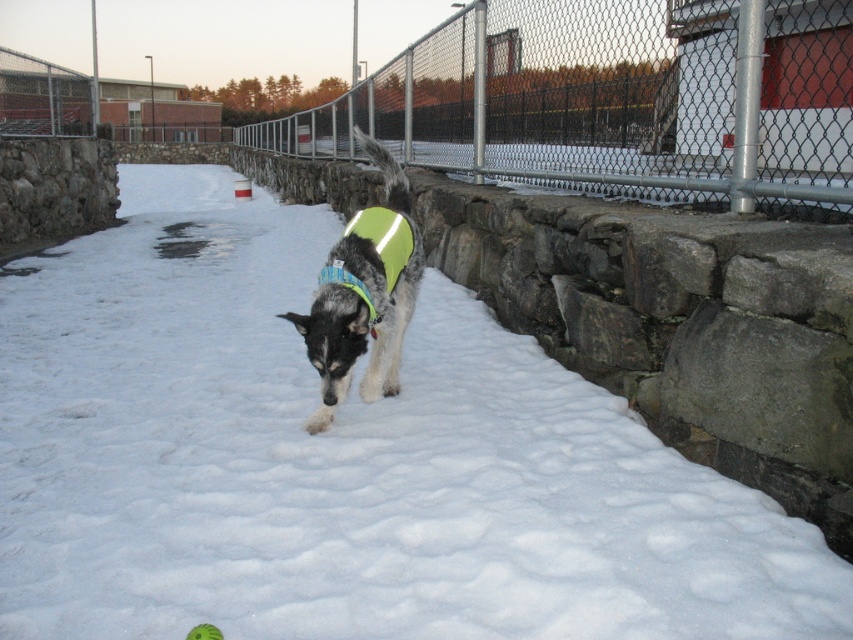
Question: Which object appears closest to the camera in this image?

Choices:
 (A) metal chain-link fence at upper center
 (B) neon green fabric vest at center
 (C) white fluffy snow at center

Answer: (C)

Question: Is white fluffy snow at center to the right of green reflective vest at center from the viewer's perspective?

Choices:
 (A) yes
 (B) no

Answer: (B)

Question: Which point is closer to the camera taking this photo?

Choices:
 (A) (360, 486)
 (B) (575, 115)
 (C) (399, 237)

Answer: (A)

Question: Considering the relative positions of metal chain-link fence at upper center and neon green fabric vest at center in the image provided, where is metal chain-link fence at upper center located with respect to neon green fabric vest at center?

Choices:
 (A) right
 (B) left

Answer: (A)

Question: Does white fluffy snow at center appear under green reflective vest at center?

Choices:
 (A) no
 (B) yes

Answer: (B)

Question: Which of the following is the farthest from the observer?

Choices:
 (A) (578, 156)
 (B) (363, 230)
 (C) (395, 161)

Answer: (A)